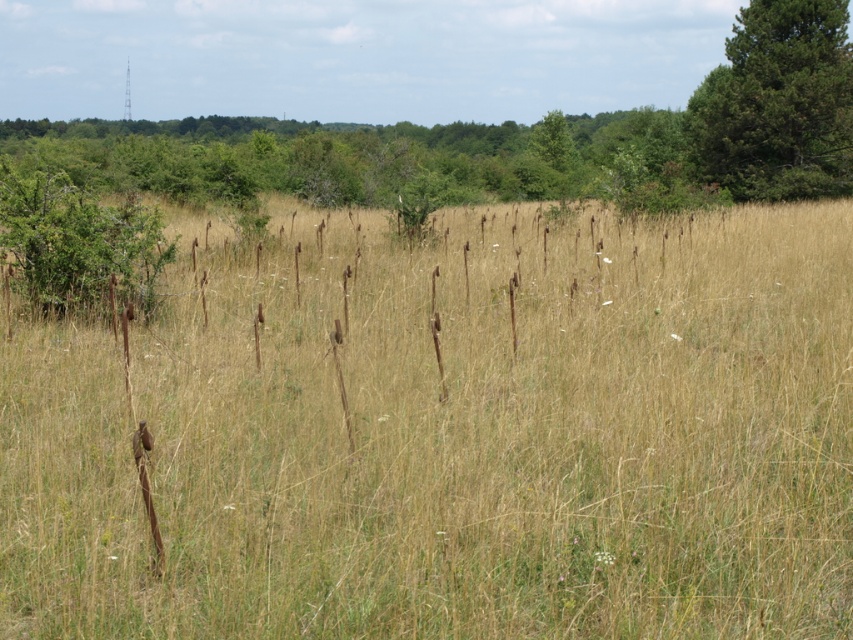
You are standing at the edge of the field and want to walk towards the radio tower in the background. If you walk straight ahead, will you encounter the dry grass at center before reaching the green textured pine tree at upper right?

The dry grass at center is 16.45 meters away from the green textured pine tree at upper right. Since you are walking towards the radio tower, which is beyond the trees, the green textured pine tree at upper right would be closer to you than the dry grass at center. Therefore, you will reach the green textured pine tree at upper right before the dry grass at center.

You are a landscape photographer planning to capture the dry grass at center and the green textured pine tree at upper right in a single frame. Which of the two objects would appear wider in your photo?

The dry grass at center would appear wider in the photo because its width surpasses that of the green textured pine tree at upper right.